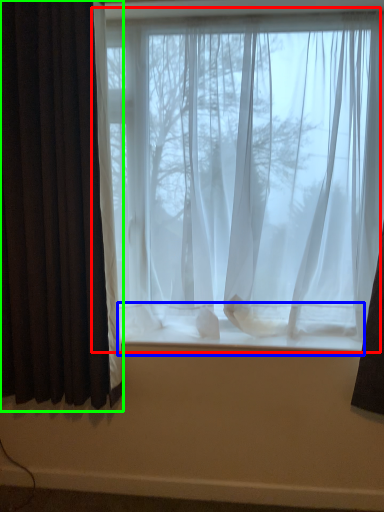
Question: Which is nearer to the window (highlighted by a red box)? window sill (highlighted by a blue box) or curtain (highlighted by a green box).

Choices:
 (A) window sill
 (B) curtain

Answer: (A)